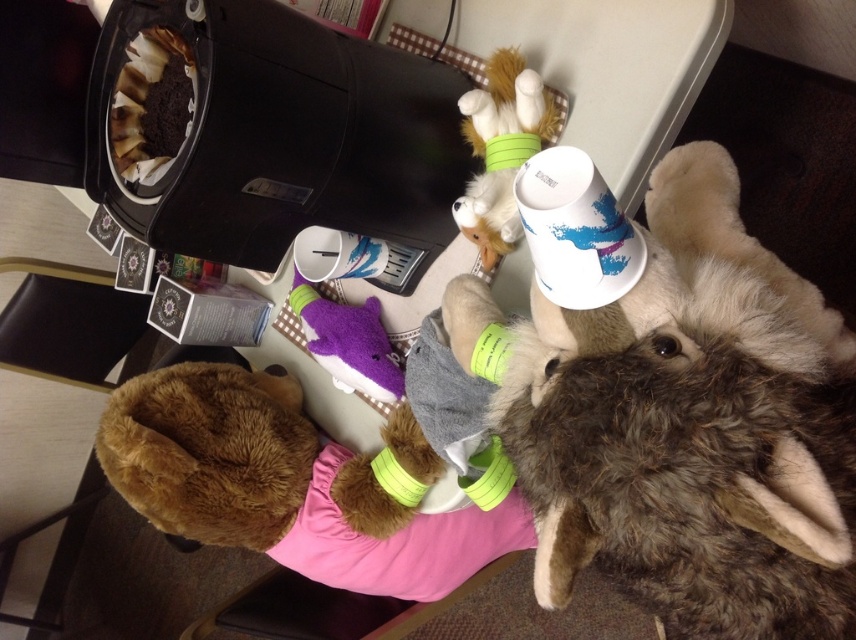
Question: Which object is the farthest from the fuzzy yellow toy at upper center?

Choices:
 (A) purple plush toy at center
 (B) fluffy brown plush at upper right

Answer: (B)

Question: Which point is closer to the camera taking this photo?

Choices:
 (A) (510, 104)
 (B) (699, 476)

Answer: (B)

Question: Does fuzzy yellow toy at upper center appear on the right side of purple plush toy at center?

Choices:
 (A) no
 (B) yes

Answer: (B)

Question: Which of the following is the closest to the observer?

Choices:
 (A) fluffy brown plush at upper right
 (B) purple plush toy at center

Answer: (A)

Question: Does fluffy brown plush at upper right come in front of purple plush toy at center?

Choices:
 (A) yes
 (B) no

Answer: (A)

Question: Can you confirm if fluffy brown plush at upper right is positioned to the right of purple plush toy at center?

Choices:
 (A) yes
 (B) no

Answer: (A)